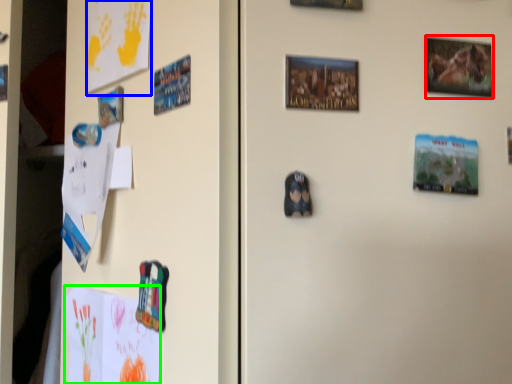
Question: Estimate the real-world distances between objects in this image. Which object is closer to picture frame (highlighted by a red box), postcard (highlighted by a blue box) or postcard (highlighted by a green box)?

Choices:
 (A) postcard
 (B) postcard

Answer: (A)